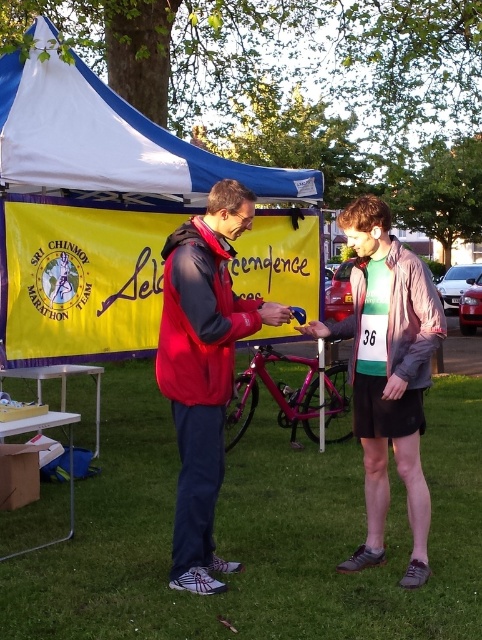
Question: Among these points, which one is nearest to the camera?

Choices:
 (A) (418, 349)
 (B) (255, 301)
 (C) (279, 634)
 (D) (2, 68)

Answer: (C)

Question: Which of the following is the closest to the observer?

Choices:
 (A) (399, 406)
 (B) (238, 225)
 (C) (452, 513)

Answer: (B)

Question: Can you confirm if red fleece jacket at center is bigger than green jersey at center?

Choices:
 (A) yes
 (B) no

Answer: (B)

Question: Does blue fabric canopy at upper left appear on the right side of green jersey at center?

Choices:
 (A) no
 (B) yes

Answer: (A)

Question: Which object appears farthest from the camera in this image?

Choices:
 (A) green jersey at center
 (B) green grass at center
 (C) red fleece jacket at center
 (D) blue fabric canopy at upper left

Answer: (D)

Question: Does green grass at center have a lesser width compared to blue fabric canopy at upper left?

Choices:
 (A) no
 (B) yes

Answer: (B)